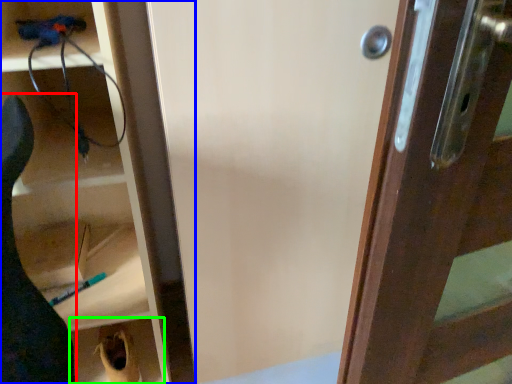
Question: Which object is positioned closest to animal (highlighted by a red box)? Select from cabinetry (highlighted by a blue box) and cabinetry (highlighted by a green box).

Choices:
 (A) cabinetry
 (B) cabinetry

Answer: (A)